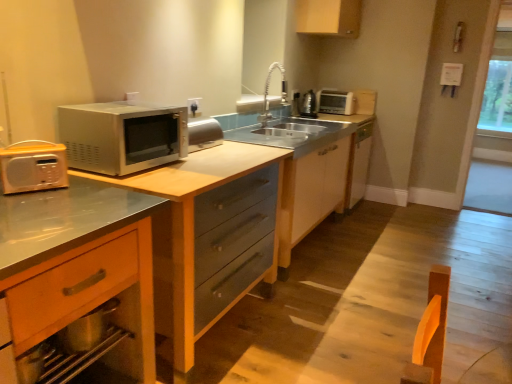
Question: Considering the positions of metallic silver kettle at upper right and transparent glass window at right, which is the 2th window screen in right-to-left order, in the image, is metallic silver kettle at upper right taller or shorter than transparent glass window at right, which is the 2th window screen in right-to-left order,?

Choices:
 (A) tall
 (B) short

Answer: (B)

Question: Choose the correct answer: Is metallic silver kettle at upper right inside transparent glass window at right, which is counted as the first window screen, starting from the left, or outside it?

Choices:
 (A) outside
 (B) inside

Answer: (A)

Question: Considering the real-world distances, which object is farthest from the white matte cabinet at center, which ranks as the first cabinetry in right-to-left order?

Choices:
 (A) transparent glass window at upper right, which appears as the 2th window screen when viewed from the left
 (B) transparent glass window at right, which is the 2th window screen in right-to-left order
 (C) satin wood dresser at center
 (D) satin nickel faucet at center
 (E) metallic silver microwave at left

Answer: (A)

Question: Considering the real-world distances, which object is closest to the wooden drawer at lower left, the 1th cabinetry positioned from the bottom?

Choices:
 (A) white plastic toaster at upper right
 (B) matte wood cabinet at upper center, placed as the second cabinetry when sorted from left to right
 (C) transparent glass window at upper right, placed as the first window screen when sorted from back to front
 (D) white matte cabinet at center, which ranks as the first cabinetry in right-to-left order
 (E) satin silver microwave at left

Answer: (E)